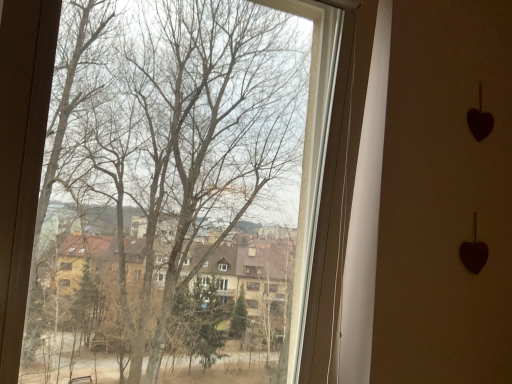
Where is `transparent glass tree at center`? The height and width of the screenshot is (384, 512). transparent glass tree at center is located at coordinates (170, 195).

Describe the element at coordinates (170, 195) in the screenshot. I see `transparent glass tree at center` at that location.

Where is `transparent glass tree at center`? transparent glass tree at center is located at coordinates (170, 195).